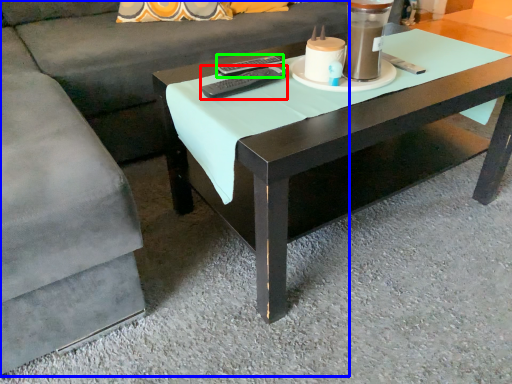
Question: Based on their relative distances, which object is farther from remote (highlighted by a red box)? Choose from couch (highlighted by a blue box) and remote (highlighted by a green box).

Choices:
 (A) couch
 (B) remote

Answer: (A)